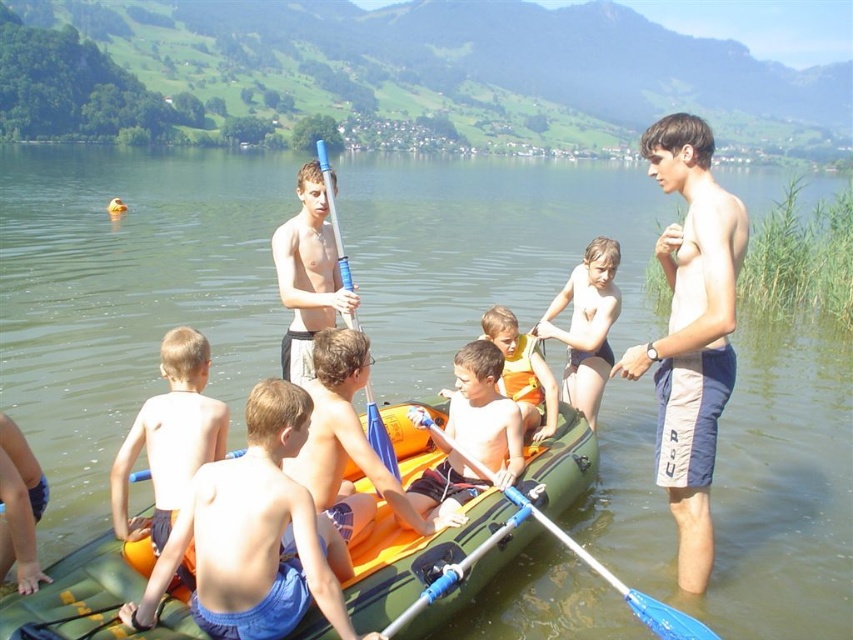
Consider the image. Based on the scene description, where is the orange rubber boat at center located in terms of coordinates?

The orange rubber boat at center is located at coordinates point (347, 444).

You are a safety inspector checking the equipment in the image. You notice the orange rubber kayak at lower left and the orange life vest at center. According to safety regulations, the life vest must be taller than the kayak to ensure visibility. Is the current setup compliant with the regulation?

The orange rubber kayak at lower left is taller than orange life vest at center, so the setup is not compliant with the regulation because the life vest needs to be taller for visibility.